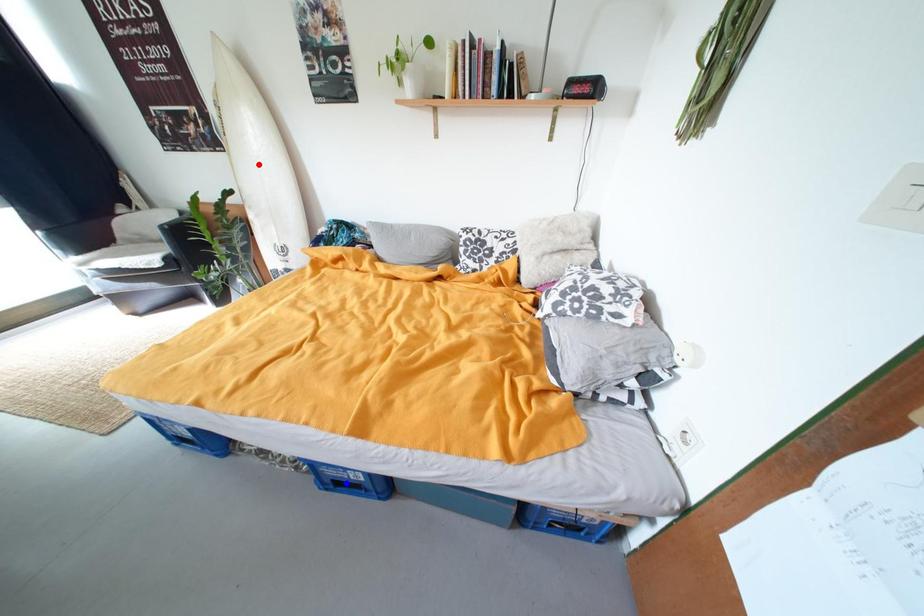
Question: Two points are marked on the image. Which point is closer to the camera?

Choices:
 (A) Blue point is closer.
 (B) Red point is closer.

Answer: (A)